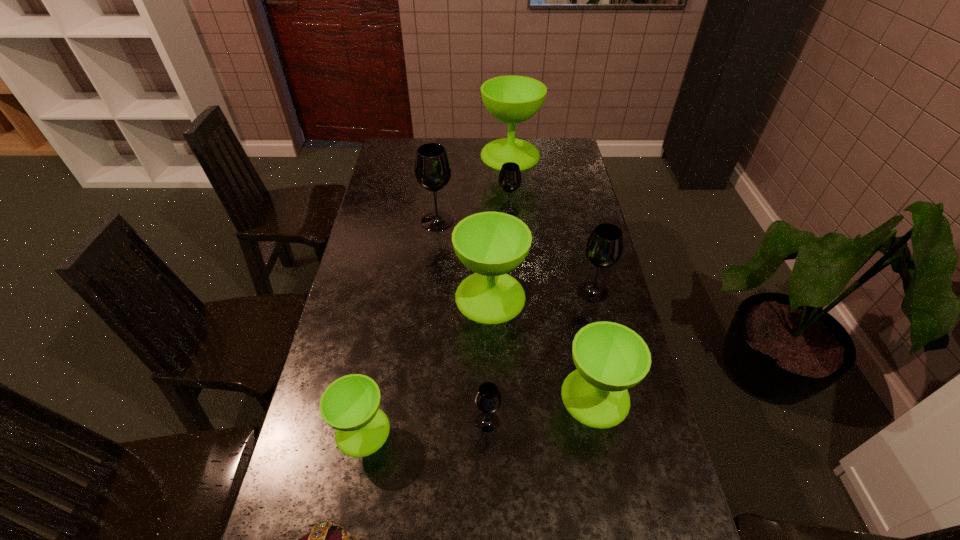
The height and width of the screenshot is (540, 960). I want to click on the leftmost wineglass, so click(350, 404).

I want to click on the nearest gray wineglass, so click(487, 398).

Identify the location of the smallest gray wineglass. This screenshot has width=960, height=540. (487, 398).

Find the location of `vacant space located 0.160m on the right of the farthest object`. vacant space located 0.160m on the right of the farthest object is located at coordinates (575, 155).

At what (x,y) coordinates should I click in order to perform the action: click on vacant area situated on the right of the leftmost gray wineglass. Please return your answer as a coordinate pair (x, y). Looking at the image, I should click on (519, 222).

Where is `free space located on the left of the rightmost gray wineglass`? This screenshot has width=960, height=540. free space located on the left of the rightmost gray wineglass is located at coordinates (488, 292).

The image size is (960, 540). What are the coordinates of `free space located on the right of the second biggest green wineglass` in the screenshot? It's located at 585,296.

I want to click on vacant position located 0.060m on the back of the third gray wineglass from left to right, so click(x=507, y=197).

You are a GUI agent. You are given a task and a screenshot of the screen. Output one action in this format:
    pyautogui.click(x=<x>, y=<y>)
    Task: Click on the free spot located on the left of the third biggest green wineglass
    The image size is (960, 540).
    Given the screenshot: What is the action you would take?
    pyautogui.click(x=415, y=396)

Identify the location of vacant space positioned on the right of the smallest green wineglass. (548, 430).